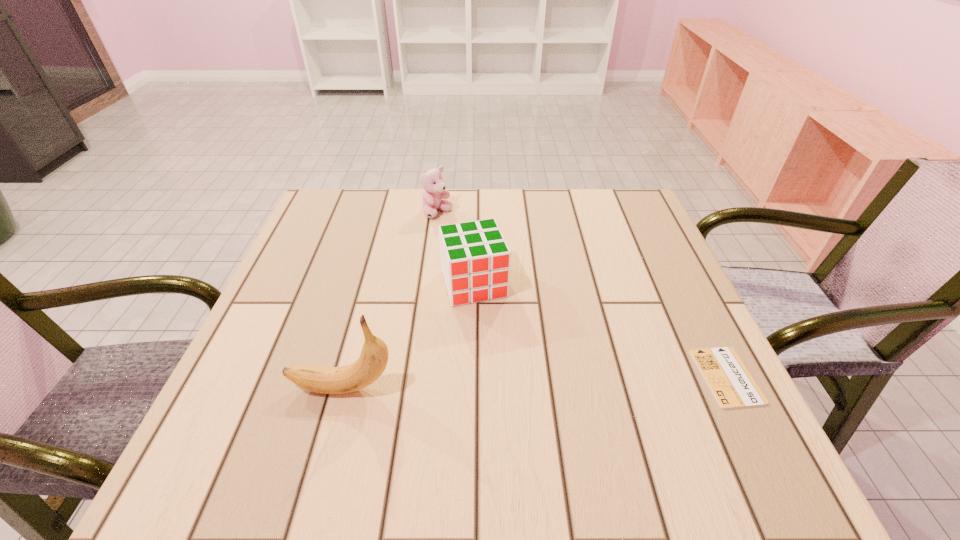
At what (x,y) coordinates should I click in order to perform the action: click on vacant space on the desktop that is between the tallest object and the identity card and is positioned at the face of the teddy bear. Please return your answer as a coordinate pair (x, y). This screenshot has width=960, height=540. Looking at the image, I should click on (544, 382).

You are a GUI agent. You are given a task and a screenshot of the screen. Output one action in this format:
    pyautogui.click(x=<x>, y=<y>)
    Task: Click on the vacant space on the desktop that is between the banana and the identity card and is positioned on the red face of the cube
    The image size is (960, 540).
    Given the screenshot: What is the action you would take?
    pyautogui.click(x=508, y=383)